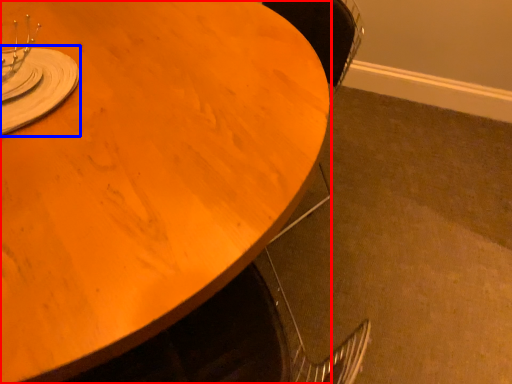
Question: Which point is further to the camera, table (highlighted by a red box) or tableware (highlighted by a blue box)?

Choices:
 (A) table
 (B) tableware

Answer: (B)